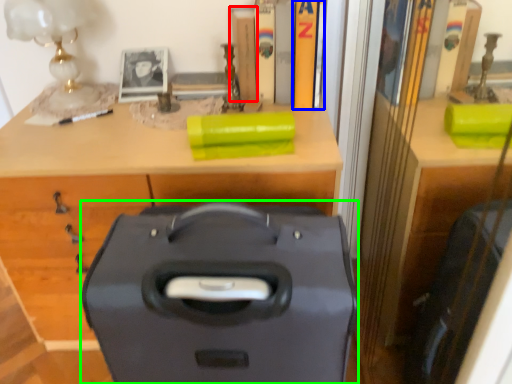
Question: Considering the real-world distances, which object is farthest from book (highlighted by a red box)? book (highlighted by a blue box) or suitcase (highlighted by a green box)?

Choices:
 (A) book
 (B) suitcase

Answer: (B)